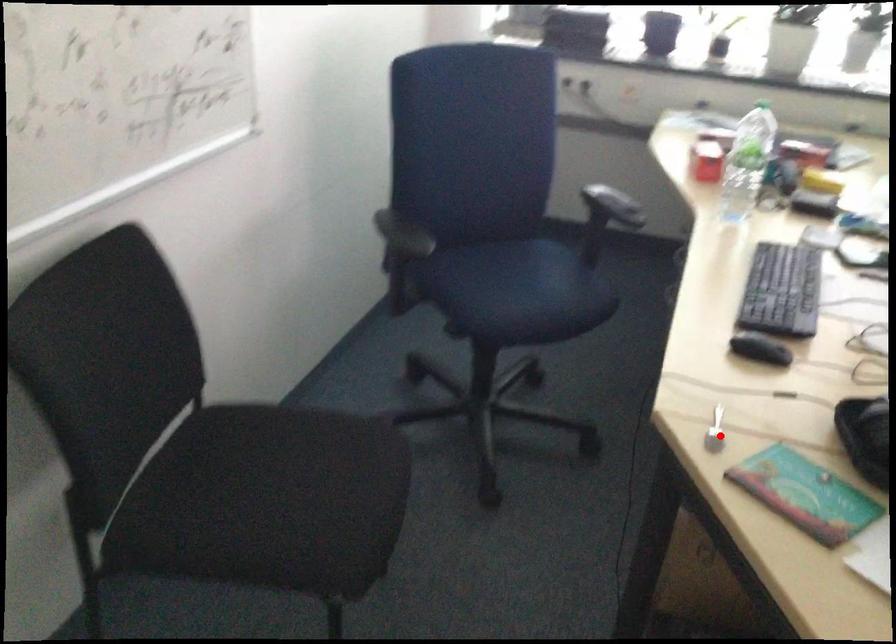
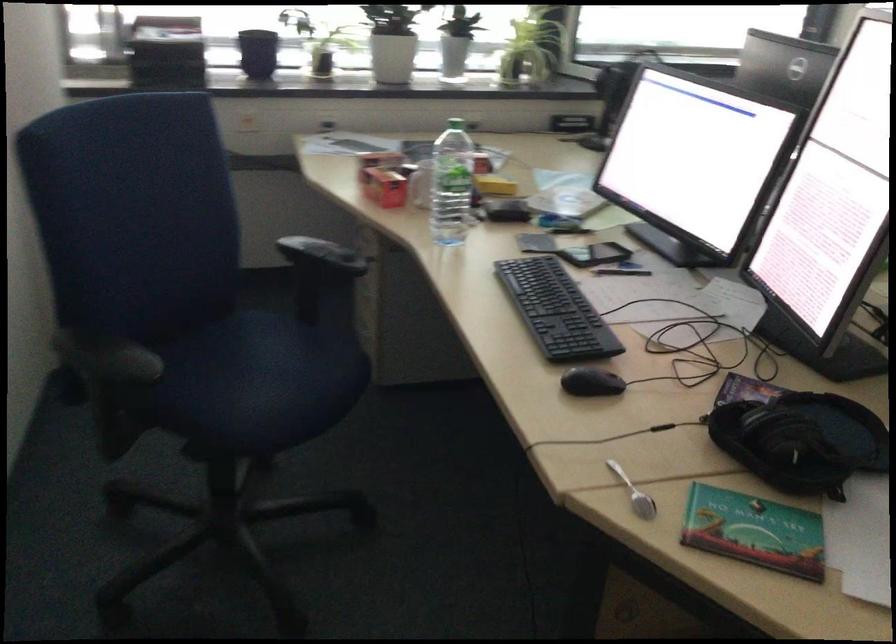
Question: I am providing you with two images of the same scene from different viewpoints. In image1, a red point is highlighted. Considering the same 3D point in image2, which of the following is correct?

Choices:
 (A) It is closer
 (B) It is farther

Answer: (A)